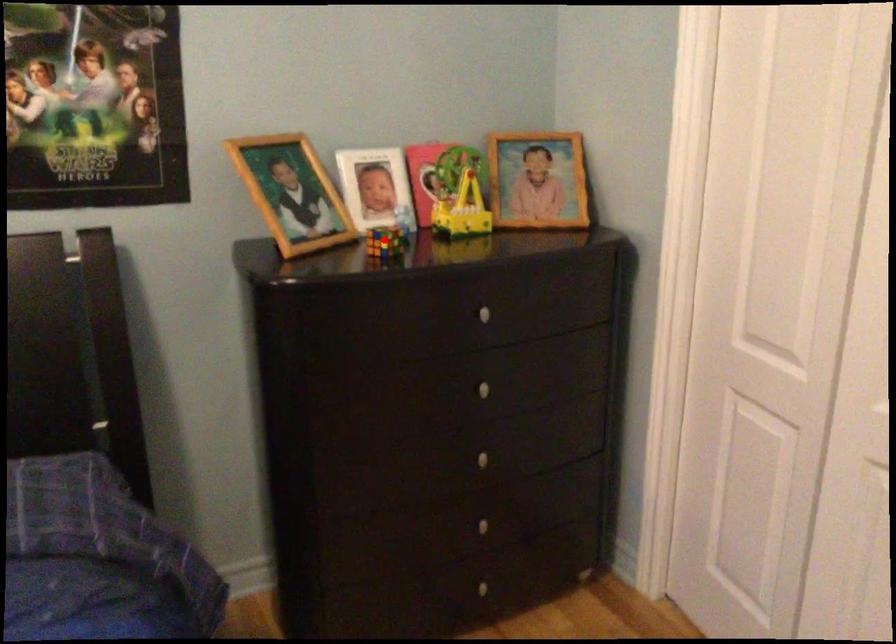
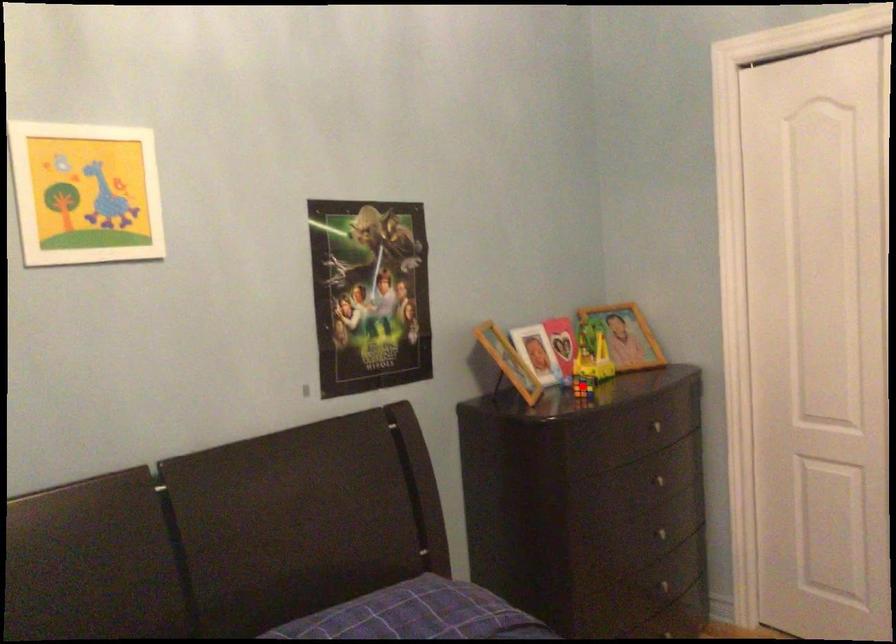
I am providing you with two images of the same scene from different viewpoints. A red point is marked on the first image and another point is marked on the second image. Do the highlighted points in image1 and image2 indicate the same real-world spot?

Yes